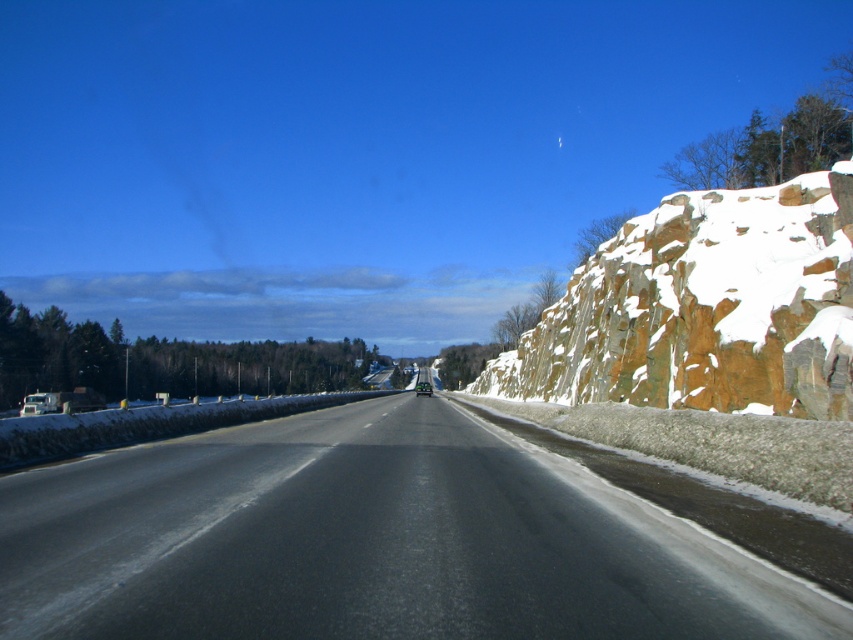
You are driving a truck that is 3 meters wide. You need to cross the black asphalt highway at center. Can your truck safely pass through the highway without going onto the snowy rock wall at right?

The black asphalt highway at center is narrower than the snowy rock wall at right. Since your truck is 3 meters wide, you need to check if the highway is wide enough. However, the description only states the highway is narrower than the rock wall but doesn not provide exact measurements. Without knowing the actual width of the highway, it is impossible to determine if the truck can safely pass. Please consult the highway specifications for accurate width details.

You are driving a truck that is 3 meters wide. You need to pass through a narrow section of the road between the snowy rock wall at right and the green matte car at center. Can your truck fit through the gap without touching either object?

The snowy rock wall at right might be wider than the green matte car at center, but without exact measurements, it is uncertain whether the gap is wide enough for a 3 meter wide truck. Proceed with caution or find an alternative route.

You are standing at the starting point of the road and want to reach the point marked as point (419, 381). There is an obstacle at point (700, 288). Can you go around the obstacle without passing through it?

Point (700, 288) is closer to the viewer than point (419, 381). Since the obstacle is closer to you, you can go around it by taking a path either to the left or right of the obstacle to reach the target point without passing through it.